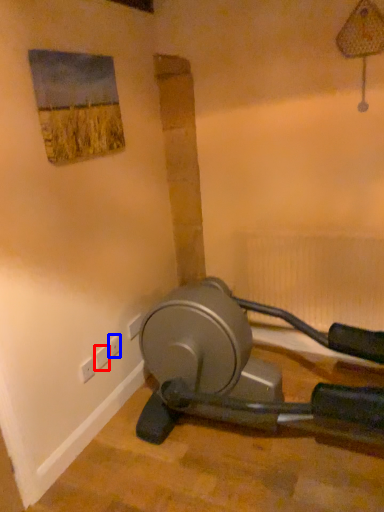
Question: Which object appears closest to the camera in this image, plug (highlighted by a red box) or electric outlet (highlighted by a blue box)?

Choices:
 (A) plug
 (B) electric outlet

Answer: (A)